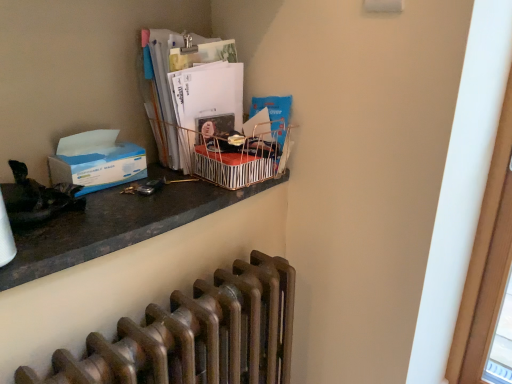
In order to click on unoccupied region to the right of blue paper at left in this screenshot , I will do `click(164, 186)`.